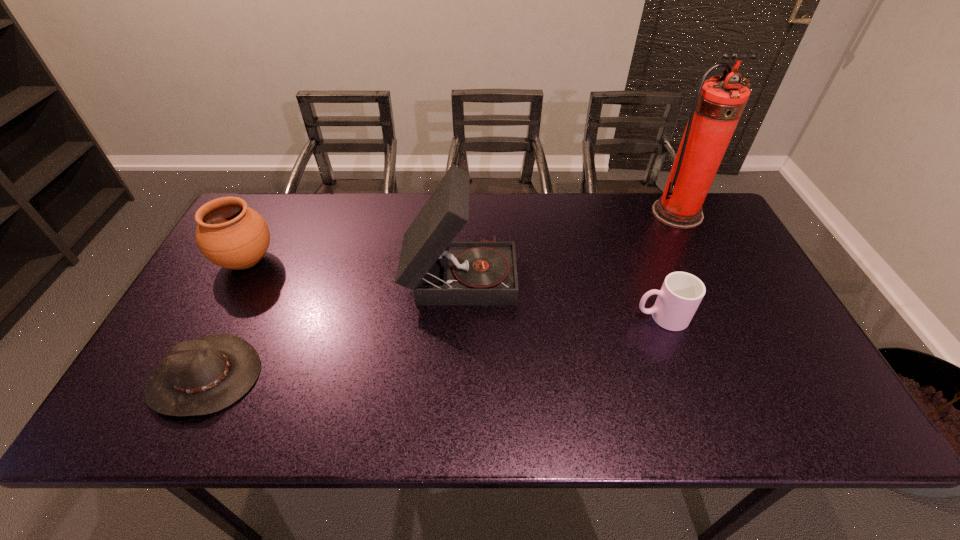
Locate an element on the screen. This screenshot has height=540, width=960. object that is positioned at the near left corner is located at coordinates (203, 376).

Find the location of a particular element. object present at the far right corner is located at coordinates (719, 102).

This screenshot has height=540, width=960. In the image, there is a desktop. What are the coordinates of `vacant space at the far edge` in the screenshot? It's located at (365, 213).

Image resolution: width=960 pixels, height=540 pixels. Identify the location of vacant space at the near edge of the desktop. (x=356, y=418).

The width and height of the screenshot is (960, 540). What are the coordinates of `free space at the left edge of the desktop` in the screenshot? It's located at (204, 305).

This screenshot has height=540, width=960. In order to click on vacant space at the far right corner of the desktop in this screenshot , I will do `click(719, 219)`.

You are a GUI agent. You are given a task and a screenshot of the screen. Output one action in this format:
    pyautogui.click(x=<x>, y=<y>)
    Task: Click on the free space between the fourth object from left to right and the rightmost object
    This screenshot has width=960, height=540.
    Given the screenshot: What is the action you would take?
    pyautogui.click(x=669, y=265)

Locate an element on the screen. The image size is (960, 540). free spot between the cup and the farthest object is located at coordinates (669, 265).

Where is `vacant point located between the pottery and the hat`? This screenshot has width=960, height=540. vacant point located between the pottery and the hat is located at coordinates (226, 319).

Image resolution: width=960 pixels, height=540 pixels. In order to click on vacant area that lies between the third object from right to left and the fourth tallest object in this screenshot , I will do `click(561, 295)`.